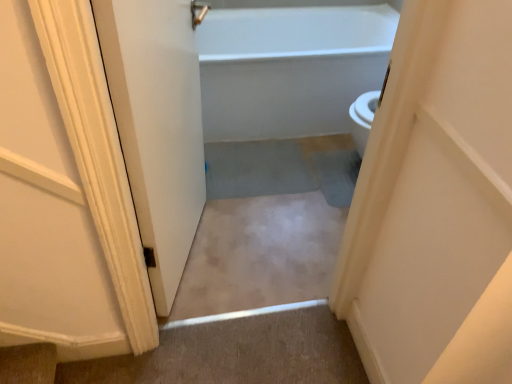
Question: Should I look upward or downward to see white matte door at center?

Choices:
 (A) up
 (B) down

Answer: (A)